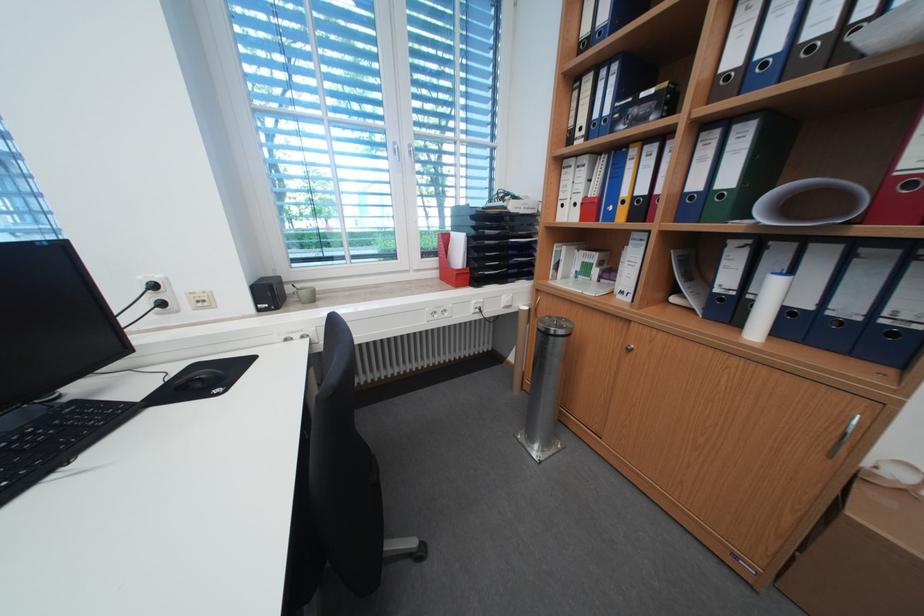
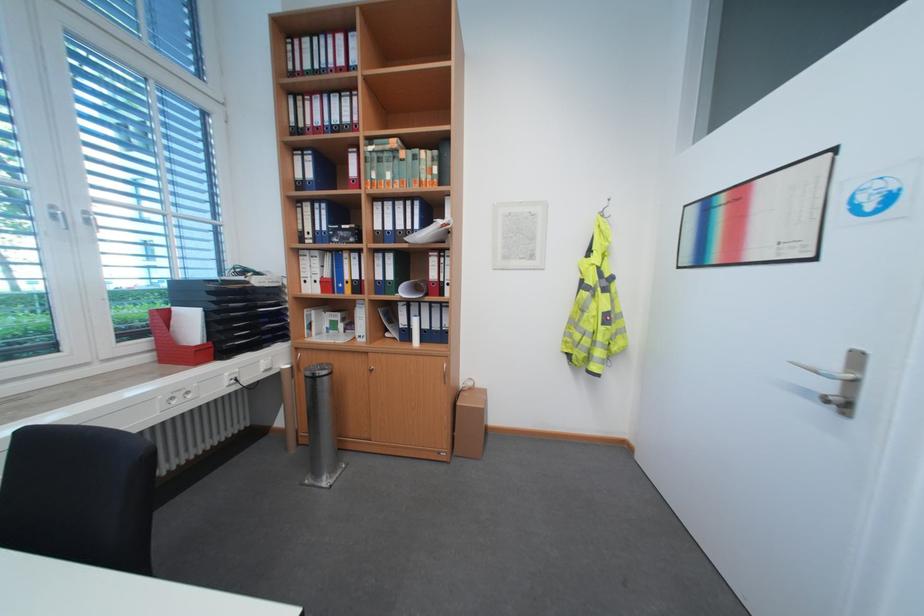
Locate, in the second image, the point that corresponds to pixel 448 272 in the first image.

(164, 355)